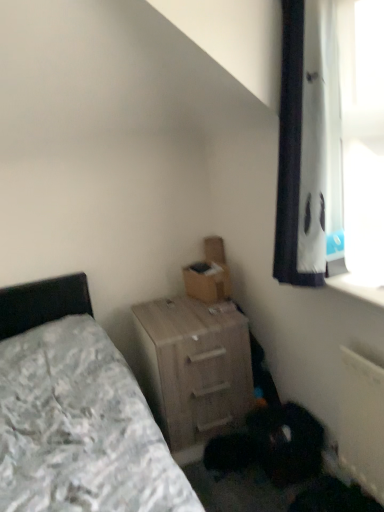
Question: Can you confirm if brown cardboard box at center is bigger than light wood nightstand at lower center?

Choices:
 (A) yes
 (B) no

Answer: (B)

Question: Is light wood nightstand at lower center inside brown cardboard box at center?

Choices:
 (A) yes
 (B) no

Answer: (B)

Question: Is brown cardboard box at center behind light wood nightstand at lower center?

Choices:
 (A) no
 (B) yes

Answer: (B)

Question: Is the surface of brown cardboard box at center in direct contact with light wood nightstand at lower center?

Choices:
 (A) no
 (B) yes

Answer: (A)

Question: From a real-world perspective, is brown cardboard box at center over light wood nightstand at lower center?

Choices:
 (A) no
 (B) yes

Answer: (B)

Question: Does brown cardboard box at center have a lesser height compared to light wood nightstand at lower center?

Choices:
 (A) yes
 (B) no

Answer: (A)

Question: Does light wood nightstand at lower center lie in front of brown cardboard box at center?

Choices:
 (A) no
 (B) yes

Answer: (B)

Question: Considering the relative sizes of light wood nightstand at lower center and brown cardboard box at center in the image provided, is light wood nightstand at lower center taller than brown cardboard box at center?

Choices:
 (A) yes
 (B) no

Answer: (A)

Question: Is light wood nightstand at lower center outside of brown cardboard box at center?

Choices:
 (A) yes
 (B) no

Answer: (A)

Question: From the image's perspective, is light wood nightstand at lower center below brown cardboard box at center?

Choices:
 (A) no
 (B) yes

Answer: (B)

Question: Is light wood nightstand at lower center beside brown cardboard box at center?

Choices:
 (A) no
 (B) yes

Answer: (A)

Question: From a real-world perspective, is light wood nightstand at lower center positioned under brown cardboard box at center based on gravity?

Choices:
 (A) yes
 (B) no

Answer: (A)

Question: In terms of width, does light wood nightstand at lower center look wider or thinner when compared to brown cardboard box at center?

Choices:
 (A) thin
 (B) wide

Answer: (B)